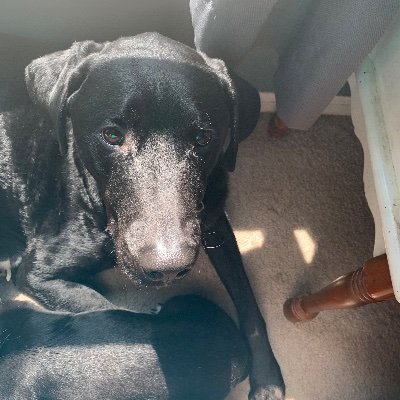
Identify the location of wooden leg. (352, 287).